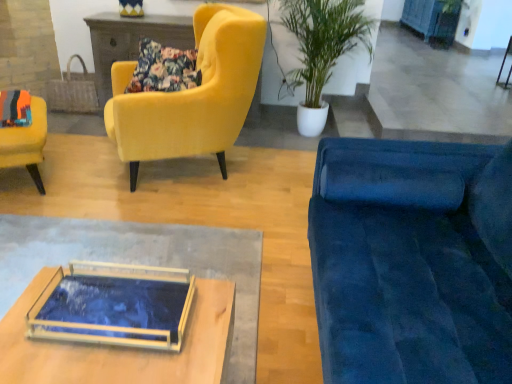
Where is `empty space that is in between translucent glass tray at center and velvet yellow armchair at upper left, the second chair positioned from the left`? empty space that is in between translucent glass tray at center and velvet yellow armchair at upper left, the second chair positioned from the left is located at coordinates (177, 206).